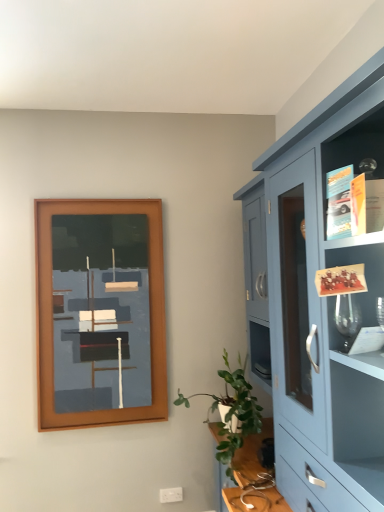
Question: Is green leafy plant at lower right positioned far away from brown wooden picture frame at upper left?

Choices:
 (A) yes
 (B) no

Answer: (B)

Question: Does green leafy plant at lower right lie behind brown wooden picture frame at upper left?

Choices:
 (A) yes
 (B) no

Answer: (B)

Question: Is green leafy plant at lower right positioned with its back to brown wooden picture frame at upper left?

Choices:
 (A) no
 (B) yes

Answer: (A)

Question: Does green leafy plant at lower right contain brown wooden picture frame at upper left?

Choices:
 (A) no
 (B) yes

Answer: (A)

Question: Is green leafy plant at lower right positioned beyond the bounds of brown wooden picture frame at upper left?

Choices:
 (A) no
 (B) yes

Answer: (B)

Question: From the image's perspective, is brown wooden picture frame at upper left located above or below matte blue cabinet at right?

Choices:
 (A) below
 (B) above

Answer: (B)

Question: From a real-world perspective, relative to matte blue cabinet at right, is brown wooden picture frame at upper left vertically above or below?

Choices:
 (A) above
 (B) below

Answer: (A)

Question: Is brown wooden picture frame at upper left inside or outside of matte blue cabinet at right?

Choices:
 (A) outside
 (B) inside

Answer: (A)

Question: Is brown wooden picture frame at upper left bigger or smaller than matte blue cabinet at right?

Choices:
 (A) small
 (B) big

Answer: (A)

Question: Is brown wooden picture frame at upper left in front of or behind green leafy plant at lower right in the image?

Choices:
 (A) behind
 (B) front

Answer: (A)

Question: From a real-world perspective, is brown wooden picture frame at upper left positioned above or below green leafy plant at lower right?

Choices:
 (A) below
 (B) above

Answer: (B)

Question: Considering the relative positions of brown wooden picture frame at upper left and green leafy plant at lower right in the image provided, is brown wooden picture frame at upper left to the left or to the right of green leafy plant at lower right?

Choices:
 (A) left
 (B) right

Answer: (A)

Question: Is brown wooden picture frame at upper left wider or thinner than green leafy plant at lower right?

Choices:
 (A) thin
 (B) wide

Answer: (A)

Question: In terms of size, does matte blue cabinet at right appear bigger or smaller than brown wooden picture frame at upper left?

Choices:
 (A) small
 (B) big

Answer: (B)

Question: Choose the correct answer: Is matte blue cabinet at right inside brown wooden picture frame at upper left or outside it?

Choices:
 (A) inside
 (B) outside

Answer: (B)